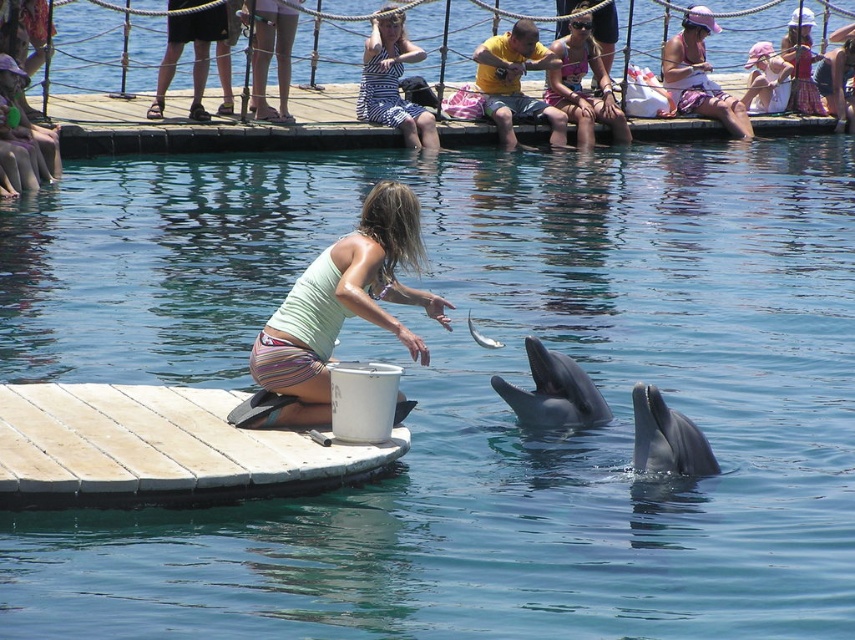
Question: Which point appears closest to the camera in this image?

Choices:
 (A) (699, 83)
 (B) (494, 104)

Answer: (B)

Question: Considering the relative positions of wooden at center and pink fabric at upper center in the image provided, where is wooden at center located with respect to pink fabric at upper center?

Choices:
 (A) right
 (B) left

Answer: (B)

Question: Which point is farther from the camera taking this photo?

Choices:
 (A) (289, 436)
 (B) (587, 60)

Answer: (B)

Question: Among these points, which one is farthest from the camera?

Choices:
 (A) (649, 134)
 (B) (509, 93)
 (C) (208, 448)

Answer: (A)

Question: Does white wood dock at center come in front of white striped dress at upper center?

Choices:
 (A) no
 (B) yes

Answer: (B)

Question: Can you confirm if wooden at center is bigger than pink fabric at upper center?

Choices:
 (A) no
 (B) yes

Answer: (B)